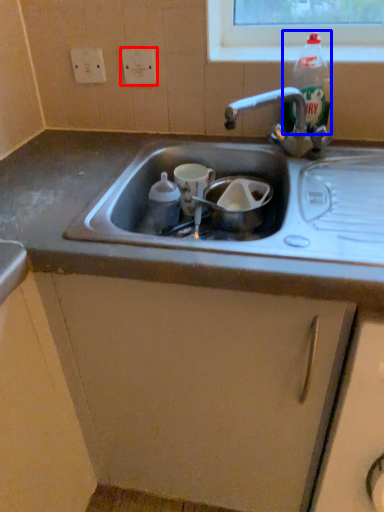
Question: Among these objects, which one is nearest to the camera, electric outlet (highlighted by a red box) or bottle (highlighted by a blue box)?

Choices:
 (A) electric outlet
 (B) bottle

Answer: (B)